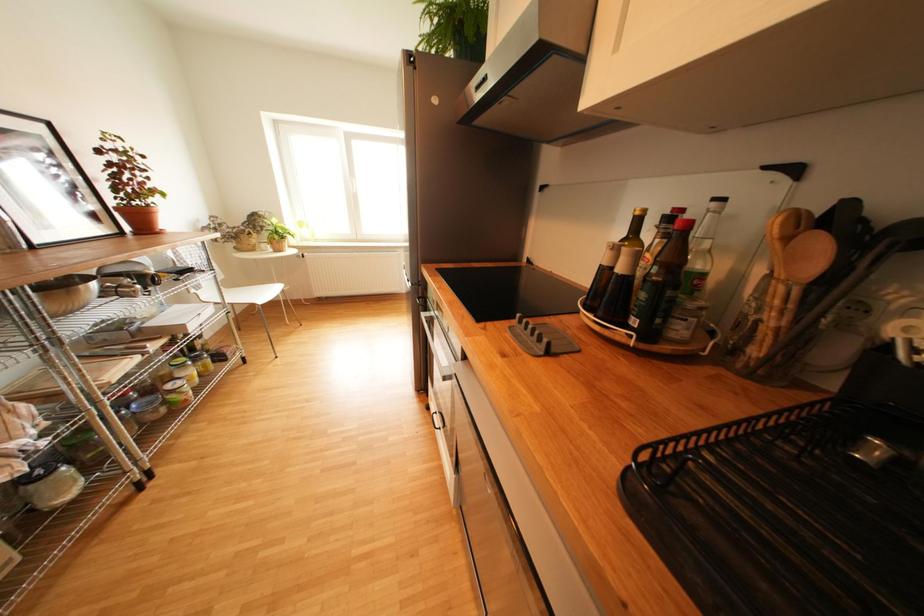
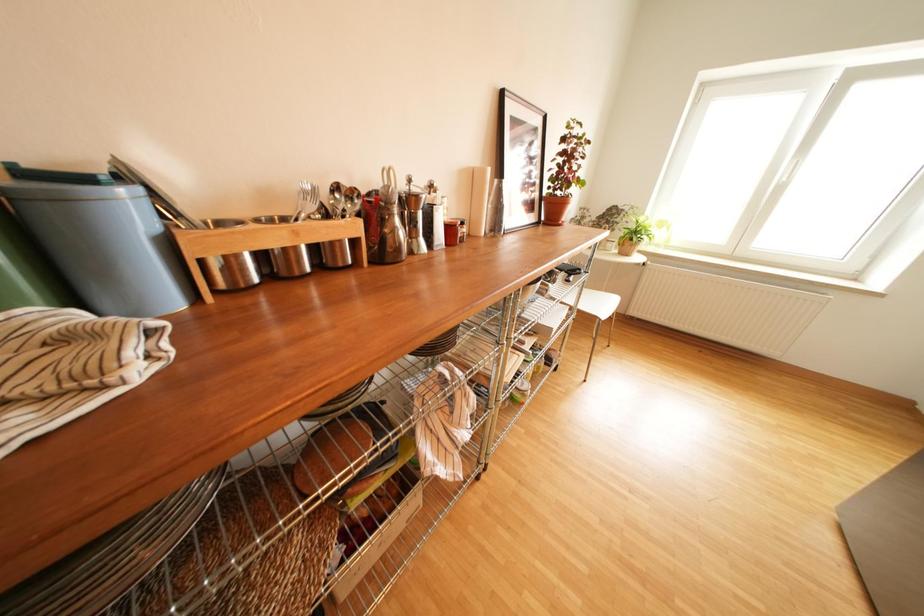
Question: How did the camera likely rotate?

Choices:
 (A) Left
 (B) Right
 (C) Up
 (D) Down

Answer: (A)